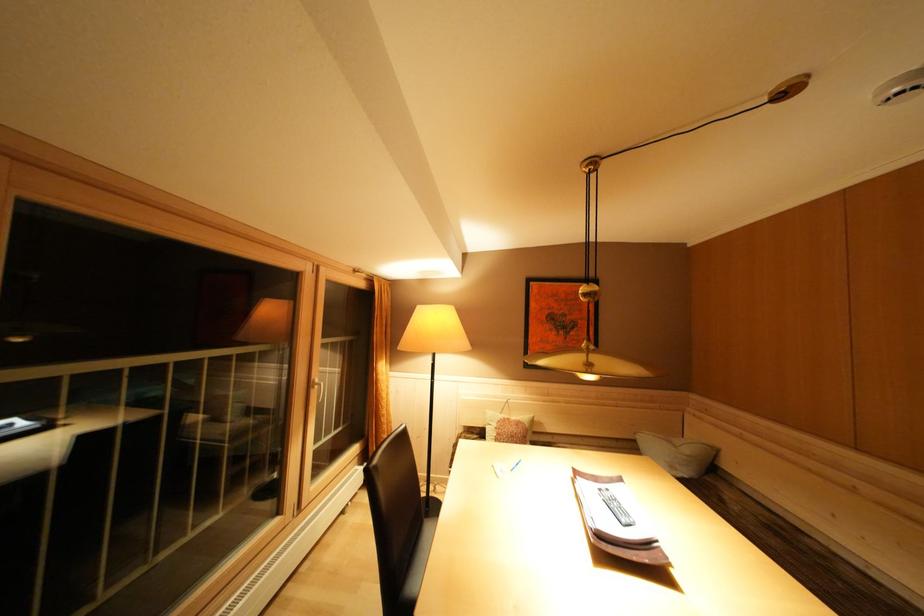
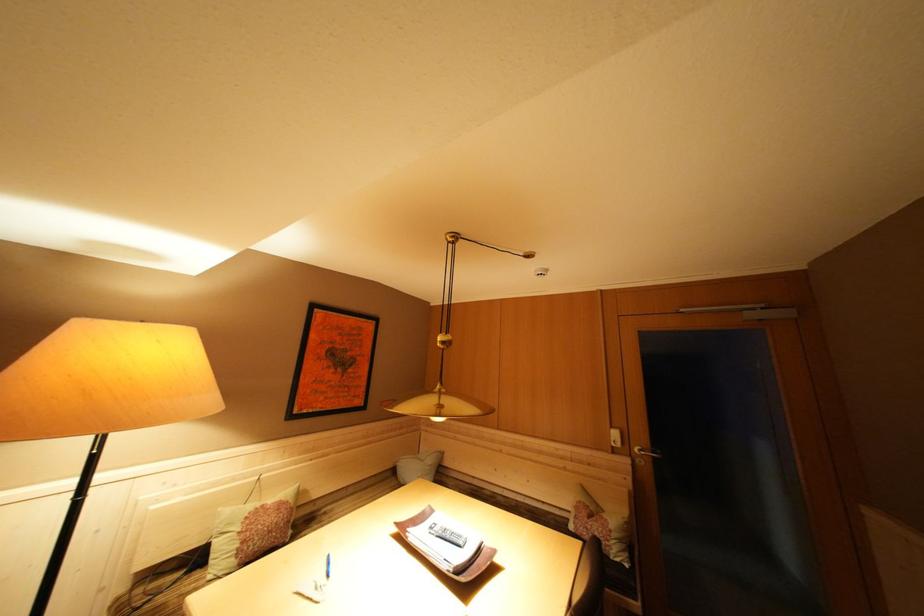
Question: How did the camera likely rotate?

Choices:
 (A) Left
 (B) Right
 (C) Up
 (D) Down

Answer: (B)